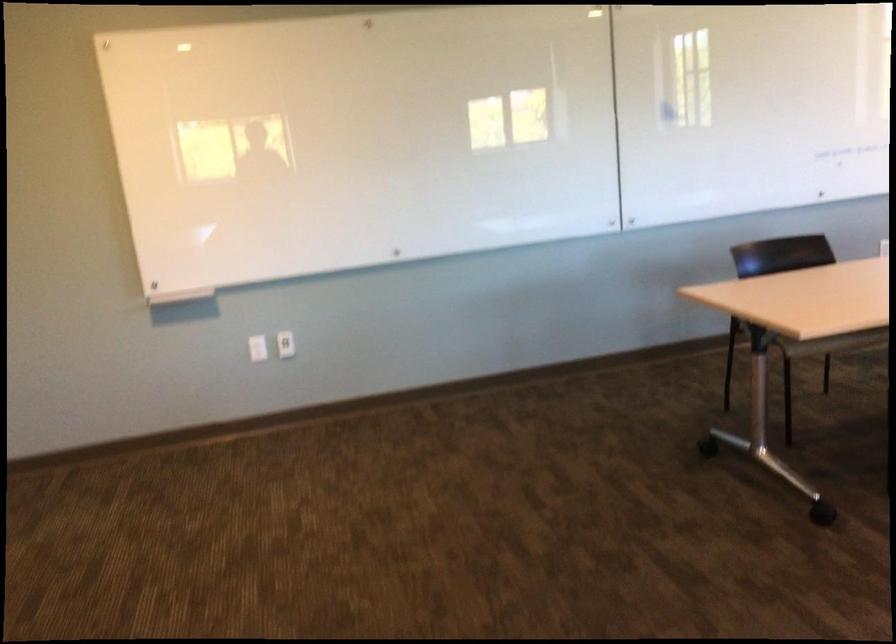
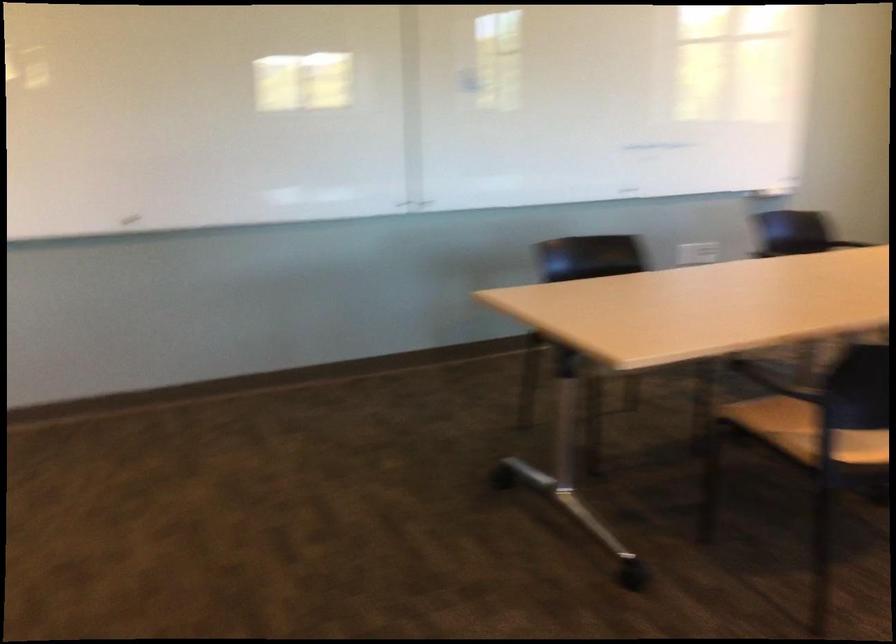
Question: The images are taken continuously from a first-person perspective. In which direction are you moving?

Choices:
 (A) Left
 (B) Right
 (C) Forward
 (D) Backward

Answer: (C)